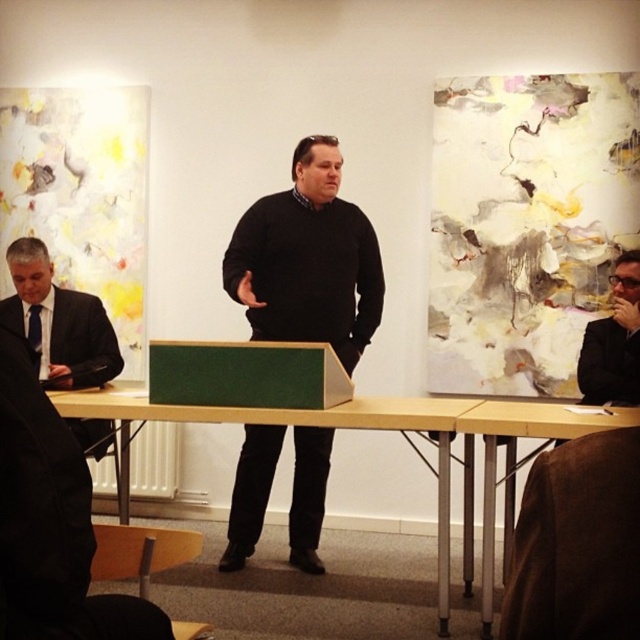
Between point (348, 348) and point (67, 372), which one is positioned in front?

Point (67, 372)

Does black sweater at center appear on the right side of matte black suit at left?

Yes, black sweater at center is to the right of matte black suit at left.

Locate an element on the screen. The height and width of the screenshot is (640, 640). black sweater at center is located at coordinates (307, 259).

Is point (44, 332) behind point (474, 426)?

Yes, point (44, 332) is behind point (474, 426).

Who is more forward, (x=19, y=241) or (x=508, y=516)?

Positioned in front is point (x=508, y=516).

Image resolution: width=640 pixels, height=640 pixels. What do you see at coordinates (58, 323) in the screenshot? I see `matte black suit at left` at bounding box center [58, 323].

Locate an element on the screen. This screenshot has height=640, width=640. matte black suit at left is located at coordinates [x=58, y=323].

How much distance is there between yellow wood table at lower right and matte black suit at right?

A distance of 17.91 inches exists between yellow wood table at lower right and matte black suit at right.

Locate an element on the screen. This screenshot has width=640, height=640. yellow wood table at lower right is located at coordinates [513, 472].

Between point (513, 490) and point (628, 289), which one is positioned behind?

The point (628, 289) is behind.

Identify the location of yellow wood table at lower right. The image size is (640, 640). (513, 472).